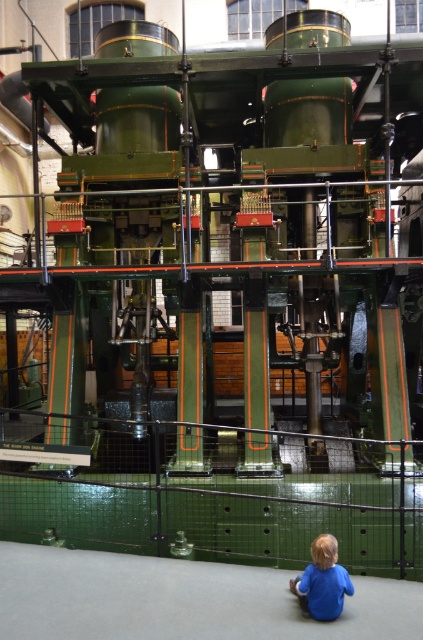
Question: Does green polished metal steam engine at center lie in front of blue matte shirt at lower center?

Choices:
 (A) no
 (B) yes

Answer: (A)

Question: Among these objects, which one is farthest from the camera?

Choices:
 (A) green polished metal steam engine at center
 (B) blue matte shirt at lower center

Answer: (A)

Question: Which object appears closest to the camera in this image?

Choices:
 (A) blue matte shirt at lower center
 (B) green polished metal steam engine at center

Answer: (A)

Question: Is green polished metal steam engine at center behind blue matte shirt at lower center?

Choices:
 (A) no
 (B) yes

Answer: (B)

Question: In this image, where is green polished metal steam engine at center located relative to blue matte shirt at lower center?

Choices:
 (A) right
 (B) left

Answer: (B)